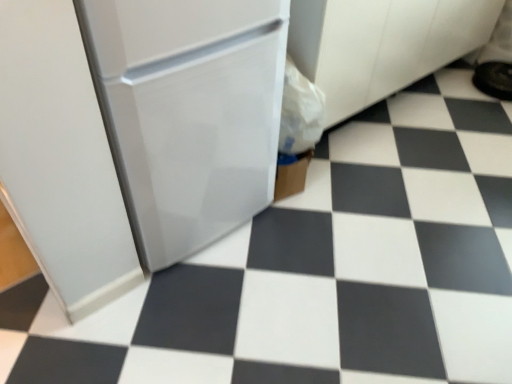
Question: From the image's perspective, would you say black rubber shoe at upper right is positioned over white glossy refrigerator at center?

Choices:
 (A) no
 (B) yes

Answer: (B)

Question: From a real-world perspective, is black rubber shoe at upper right positioned over white glossy refrigerator at center based on gravity?

Choices:
 (A) no
 (B) yes

Answer: (A)

Question: Does black rubber shoe at upper right have a greater width compared to white glossy refrigerator at center?

Choices:
 (A) yes
 (B) no

Answer: (B)

Question: Is the depth of black rubber shoe at upper right greater than that of white glossy refrigerator at center?

Choices:
 (A) yes
 (B) no

Answer: (A)

Question: Is black rubber shoe at upper right aimed at white glossy refrigerator at center?

Choices:
 (A) no
 (B) yes

Answer: (A)

Question: From a real-world perspective, is black rubber shoe at upper right physically below white glossy refrigerator at center?

Choices:
 (A) yes
 (B) no

Answer: (A)

Question: Is white glossy refrigerator at center thinner than black rubber shoe at upper right?

Choices:
 (A) no
 (B) yes

Answer: (A)

Question: Is white glossy refrigerator at center taller than black rubber shoe at upper right?

Choices:
 (A) no
 (B) yes

Answer: (B)

Question: Is white glossy refrigerator at center facing towards black rubber shoe at upper right?

Choices:
 (A) yes
 (B) no

Answer: (B)

Question: Is white glossy refrigerator at center positioned far away from black rubber shoe at upper right?

Choices:
 (A) no
 (B) yes

Answer: (B)

Question: From a real-world perspective, is white glossy refrigerator at center located beneath black rubber shoe at upper right?

Choices:
 (A) yes
 (B) no

Answer: (B)

Question: Would you say black rubber shoe at upper right is part of white glossy refrigerator at center's contents?

Choices:
 (A) no
 (B) yes

Answer: (A)

Question: Considering the positions of white glossy refrigerator at center and black rubber shoe at upper right in the image, is white glossy refrigerator at center bigger or smaller than black rubber shoe at upper right?

Choices:
 (A) small
 (B) big

Answer: (B)